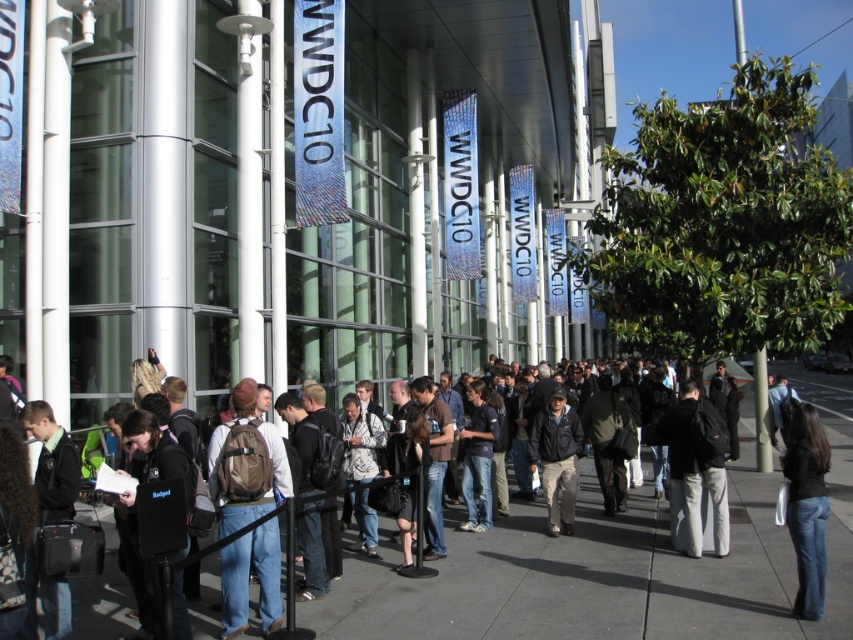
Between point (724, 520) and point (550, 428), which one is positioned behind?

The point (550, 428) is more distant.

Which of these two, dark gray backpack at center or dark gray jacket at center, stands shorter?

Standing shorter between the two is dark gray jacket at center.

This screenshot has width=853, height=640. In order to click on dark gray backpack at center in this screenshot , I will do `click(697, 461)`.

Is brown backpack at center thinner than dark gray backpack at center?

Incorrect, brown backpack at center's width is not less than dark gray backpack at center's.

Between brown backpack at center and dark gray backpack at center, which one is positioned higher?

brown backpack at center is higher up.

Does point (229, 476) come closer to viewer compared to point (695, 442)?

Yes, it is in front of point (695, 442).

This screenshot has width=853, height=640. I want to click on brown backpack at center, so click(x=247, y=464).

Is point (793, 531) positioned after point (560, 460)?

No, it is in front of (560, 460).

Does denim jeans at lower right have a smaller size compared to dark gray jacket at center?

No.

Where is `denim jeans at lower right`? This screenshot has height=640, width=853. denim jeans at lower right is located at coordinates (807, 506).